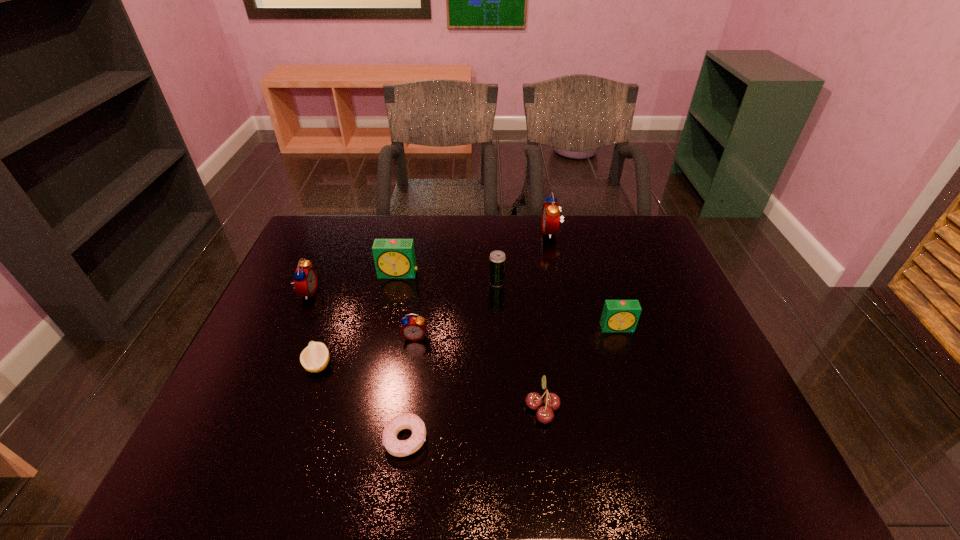
Identify the location of the tallest object. (551, 210).

Find the location of `the tallest alarm clock`. the tallest alarm clock is located at coordinates (551, 210).

This screenshot has height=540, width=960. In order to click on the second biggest red alarm clock in this screenshot , I will do `click(305, 282)`.

This screenshot has height=540, width=960. Identify the location of the leftmost alarm clock. tap(305, 282).

The height and width of the screenshot is (540, 960). Identify the location of the bigger green alarm clock. (394, 258).

At what (x,y) coordinates should I click in order to perform the action: click on the farther green alarm clock. Please return your answer as a coordinate pair (x, y). Looking at the image, I should click on [x=394, y=258].

What are the coordinates of `beer can` in the screenshot? It's located at (497, 259).

The height and width of the screenshot is (540, 960). Identify the location of the nearest red alarm clock. (413, 328).

Where is `the smallest red alarm clock`? This screenshot has width=960, height=540. the smallest red alarm clock is located at coordinates (413, 328).

Where is `the right green alarm clock`? Image resolution: width=960 pixels, height=540 pixels. the right green alarm clock is located at coordinates (618, 315).